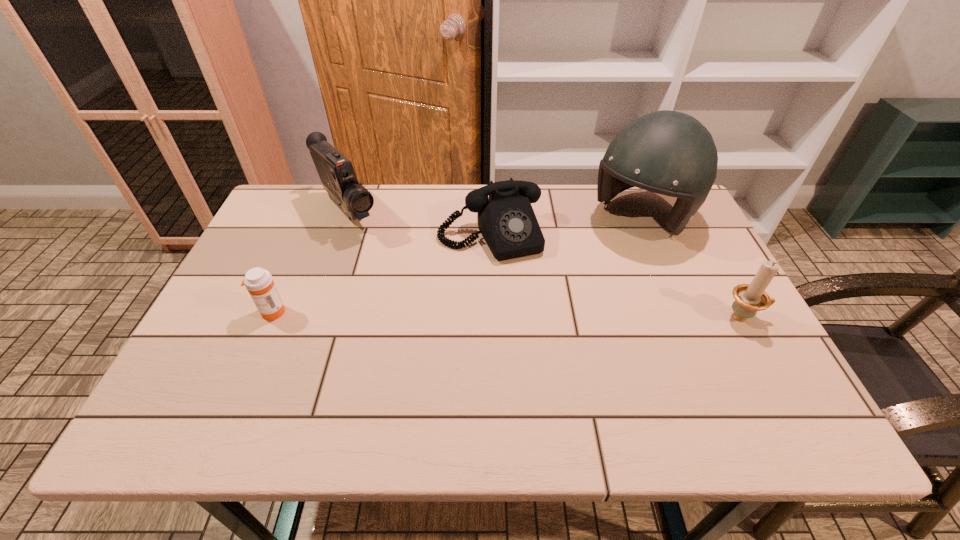
Locate which object is the third closest to the football helmet. Please provide its 2D coordinates. Your answer should be formatted as a tuple, i.e. [(x, y)], where the tuple contains the x and y coordinates of a point satisfying the conditions above.

[(336, 172)]

Identify the location of vacant region that satisfies the following two spatial constraints: 1. on the front side of the camcorder; 2. on the left side of the football helmet. The image size is (960, 540). (347, 218).

Identify the location of vacant space that satisfies the following two spatial constraints: 1. on the front side of the third tallest object; 2. on the handle side of the tallest object. Image resolution: width=960 pixels, height=540 pixels. (684, 317).

Where is `free space that satisfies the following two spatial constraints: 1. on the front side of the third tallest object; 2. on the handle side of the third object from right to left`? free space that satisfies the following two spatial constraints: 1. on the front side of the third tallest object; 2. on the handle side of the third object from right to left is located at coordinates (492, 317).

Find the location of `vacant area that satisfies the following two spatial constraints: 1. on the front side of the third shortest object; 2. on the handle side of the medicine`. vacant area that satisfies the following two spatial constraints: 1. on the front side of the third shortest object; 2. on the handle side of the medicine is located at coordinates (270, 317).

At what (x,y) coordinates should I click in order to perform the action: click on vacant position in the image that satisfies the following two spatial constraints: 1. on the front side of the tallest object; 2. on the handle side of the candle_holder. Please return your answer as a coordinate pair (x, y). The height and width of the screenshot is (540, 960). Looking at the image, I should click on (684, 317).